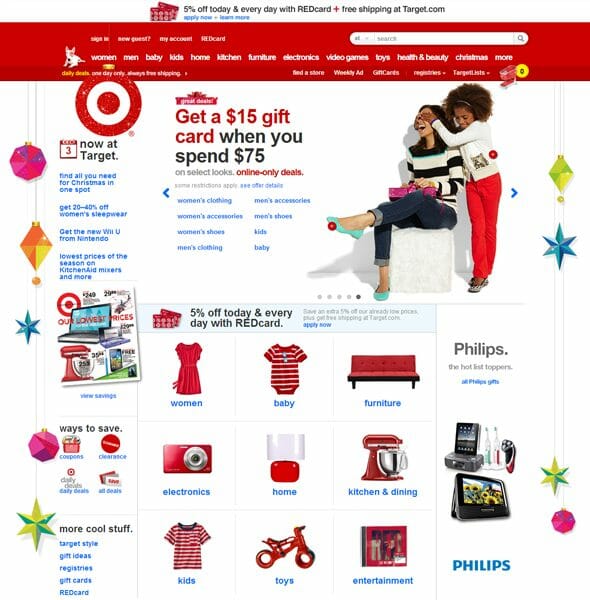
Identify the location of the 2nd toothbrush from the left. (497, 456).